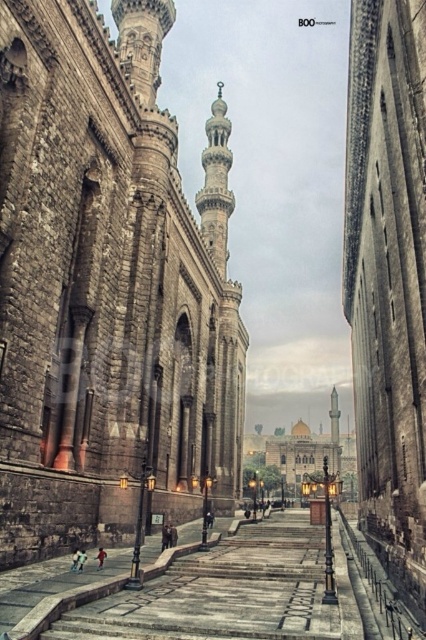
You are standing at the entrance of the mosque and see two points marked on the pathway. The first point is at coordinate point (132, 65) and the second is at point (212, 221). If you walk straight along the pathway towards the central minaret, which point will you encounter first?

Since point (132, 65) is in front of point (212, 221), you will encounter point (132, 65) first while walking towards the central minaret.

You are standing at the entrance of the mosque and want to take a photo that includes both the dark brown stone tower at center and the smooth stone minaret at center. Which one of these two structures should you position closer to the front of your camera frame to ensure both are fully visible in the photo?

→ You should position the smooth stone minaret at center closer to the front of your camera frame because the dark brown stone tower at center is taller than smooth stone minaret at center. This way, the shorter minaret can be placed near the front without blocking the view of the taller tower behind it.